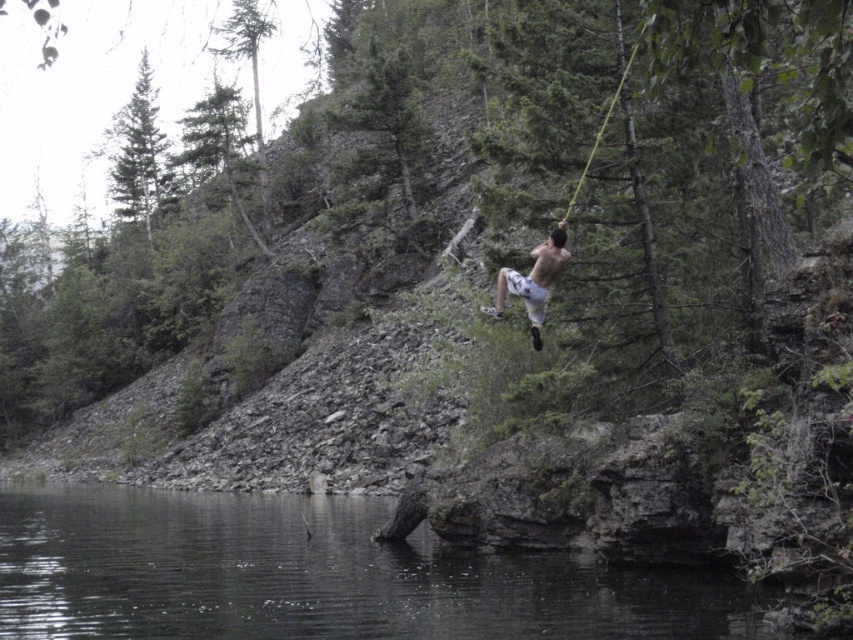
Question: Which object appears closest to the camera in this image?

Choices:
 (A) white cotton shorts at center
 (B) transparent water at lower center

Answer: (B)

Question: Which object appears farthest from the camera in this image?

Choices:
 (A) white cotton shorts at center
 (B) transparent water at lower center

Answer: (A)

Question: Does transparent water at lower center appear on the right side of white cotton shorts at center?

Choices:
 (A) no
 (B) yes

Answer: (A)

Question: Does transparent water at lower center have a smaller size compared to white cotton shorts at center?

Choices:
 (A) no
 (B) yes

Answer: (A)

Question: From the image, what is the correct spatial relationship of transparent water at lower center in relation to white cotton shorts at center?

Choices:
 (A) below
 (B) above

Answer: (A)